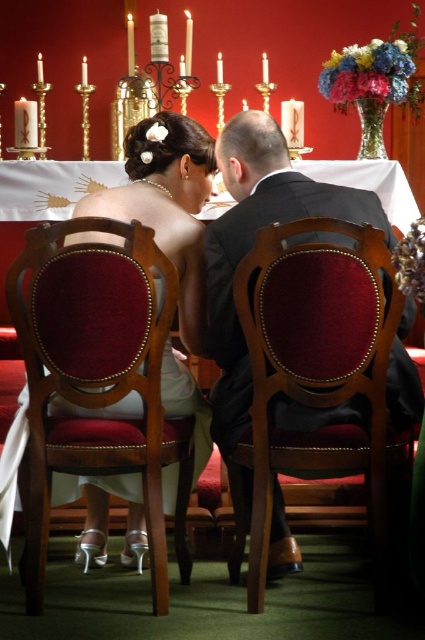
Question: Does velvet red chair at center appear on the left side of satin white dress at center?

Choices:
 (A) no
 (B) yes

Answer: (A)

Question: Is velvet red chair at left below velvet red chair at center?

Choices:
 (A) yes
 (B) no

Answer: (A)

Question: Which point is closer to the camera taking this photo?

Choices:
 (A) (113, 426)
 (B) (189, 243)

Answer: (A)

Question: Which point is farther to the camera?

Choices:
 (A) (354, 342)
 (B) (104, 362)

Answer: (B)

Question: Which point is farther to the camera?

Choices:
 (A) (93, 516)
 (B) (156, 561)
 (C) (368, 280)

Answer: (A)

Question: Can you confirm if velvet red chair at left is positioned below satin white dress at center?

Choices:
 (A) yes
 (B) no

Answer: (A)